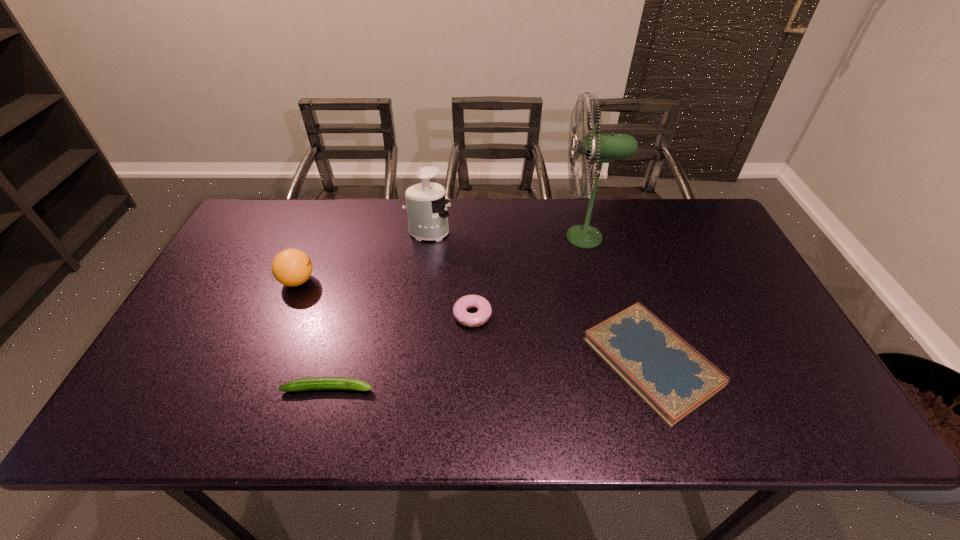
Where is `vacant space at the near edge of the desktop`? This screenshot has height=540, width=960. vacant space at the near edge of the desktop is located at coordinates (391, 418).

The image size is (960, 540). In the image, there is a desktop. In order to click on free space at the left edge in this screenshot , I will do `click(232, 335)`.

The image size is (960, 540). Find the location of `free space at the right edge of the desktop`. free space at the right edge of the desktop is located at coordinates (766, 356).

At what (x,y) coordinates should I click in order to perform the action: click on vacant space at the near right corner of the desktop. Please return your answer as a coordinate pair (x, y). The width and height of the screenshot is (960, 540). Looking at the image, I should click on (784, 414).

Identify the location of vacant region between the paperback book and the doughnut. This screenshot has width=960, height=540. (562, 338).

Locate an element on the screen. vacant region between the third tallest object and the doughnut is located at coordinates (385, 298).

Identify the location of free spot between the paperback book and the fan. (618, 299).

The height and width of the screenshot is (540, 960). Identify the location of free space between the leftmost object and the third object from right to left. pos(385,298).

The image size is (960, 540). What are the coordinates of `free space between the juicer and the doughnut` in the screenshot? It's located at (450, 274).

In order to click on vacant area that lies between the third object from left to right and the doughnut in this screenshot , I will do `click(450, 274)`.